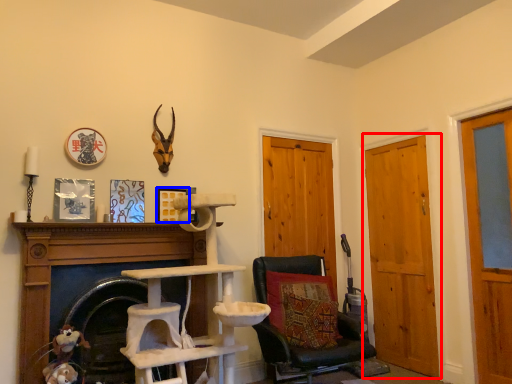
Question: Which of the following is the farthest to the observer, door (highlighted by a red box) or picture frame (highlighted by a blue box)?

Choices:
 (A) door
 (B) picture frame

Answer: (A)